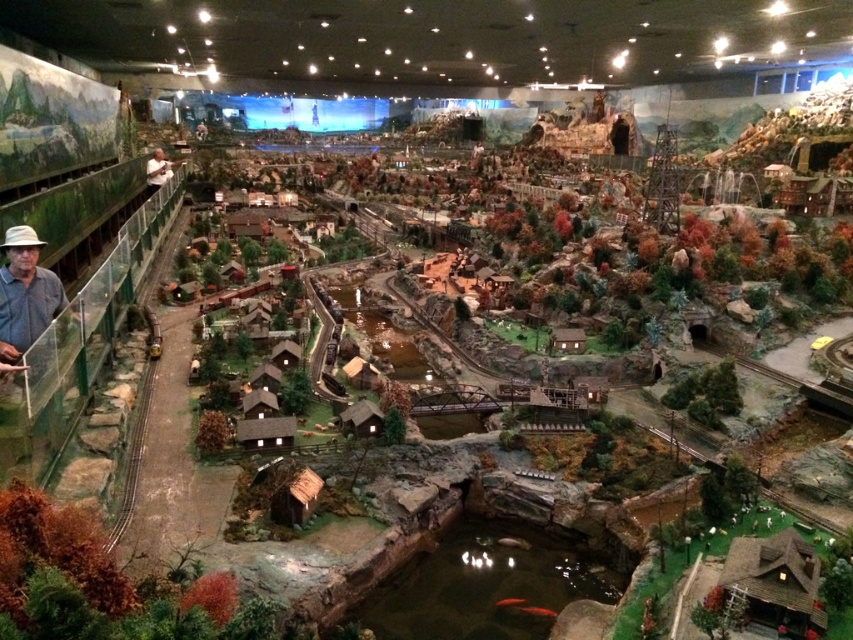
Question: Can you confirm if denim shirt at left is positioned to the right of smooth tan shirt at left?

Choices:
 (A) no
 (B) yes

Answer: (B)

Question: Does denim shirt at left appear over smooth tan shirt at left?

Choices:
 (A) yes
 (B) no

Answer: (B)

Question: Is denim shirt at left to the right of smooth tan shirt at left from the viewer's perspective?

Choices:
 (A) no
 (B) yes

Answer: (B)